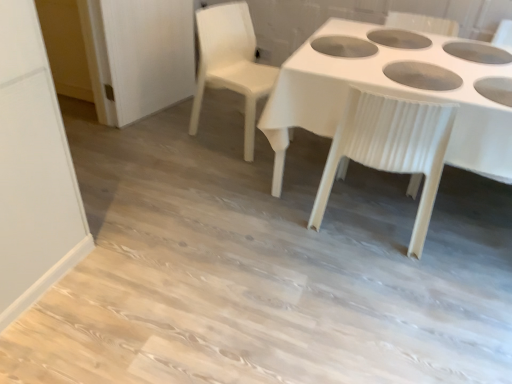
This screenshot has width=512, height=384. What are the coordinates of `free location in front of white plastic chair at upper center, positioned as the second chair in right-to-left order` in the screenshot? It's located at [221, 168].